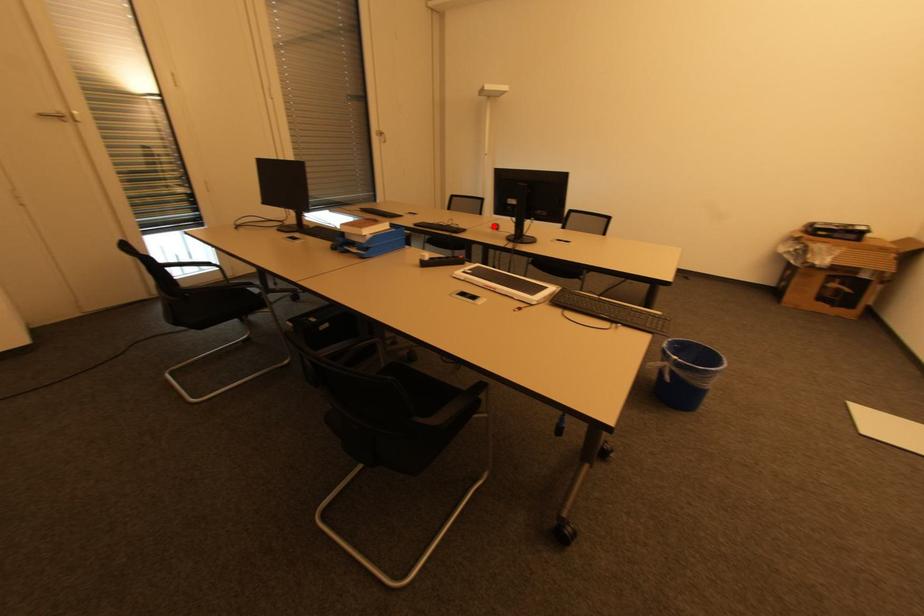
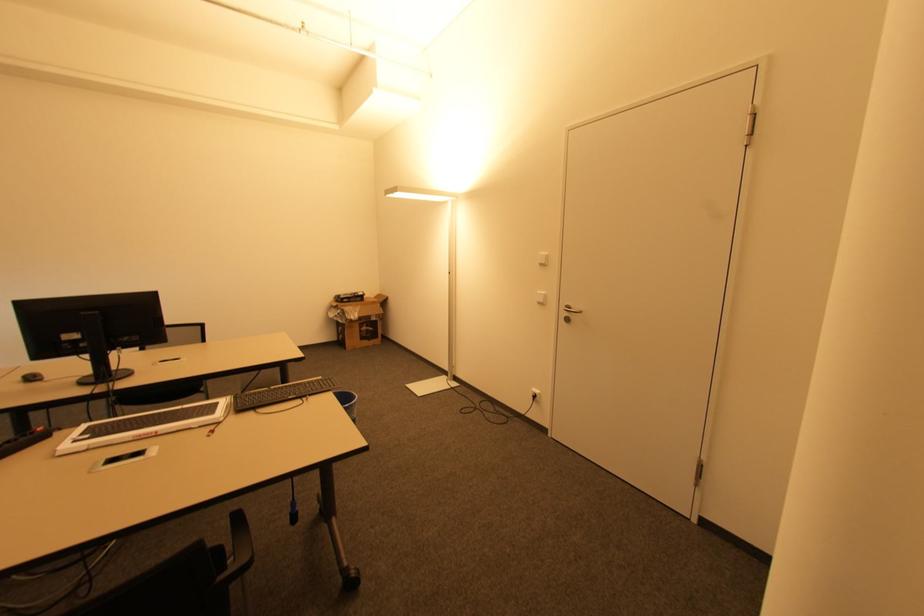
Question: I am providing you with two images of the same scene from different viewpoints. In image1, a red point is highlighted. Considering the same 3D point in image2, which of the following is correct?

Choices:
 (A) It is closer
 (B) It is farther

Answer: (B)